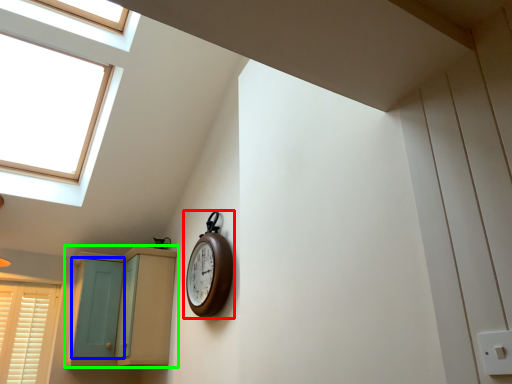
Question: Which object is the closest to the clock (highlighted by a red box)? Choose among these: screen door (highlighted by a blue box) or cabinetry (highlighted by a green box).

Choices:
 (A) screen door
 (B) cabinetry

Answer: (B)